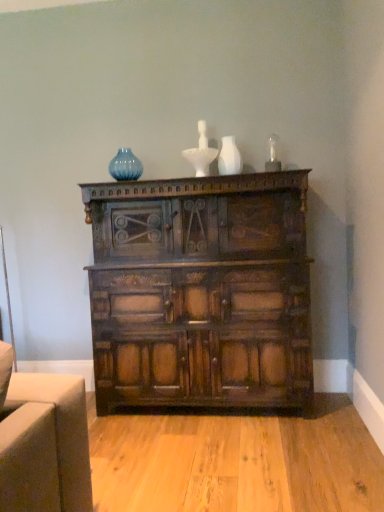
Question: Would you say white matte vase at upper center is to the left or to the right of dark brown wood chest of drawers at center in the picture?

Choices:
 (A) right
 (B) left

Answer: (A)

Question: In terms of height, does white matte vase at upper center look taller or shorter compared to dark brown wood chest of drawers at center?

Choices:
 (A) tall
 (B) short

Answer: (B)

Question: Which is nearer to the dark brown wood chest of drawers at center?

Choices:
 (A) blue glass vase at upper center
 (B) white matte vase at upper center

Answer: (B)

Question: Considering the real-world distances, which object is farthest from the white matte vase at upper center?

Choices:
 (A) dark brown wood chest of drawers at center
 (B) blue glass vase at upper center

Answer: (A)